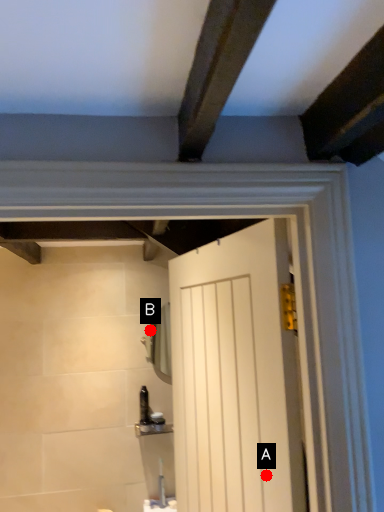
Question: Two points are circled on the image, labeled by A and B beside each circle. Which point is closer to the camera taking this photo?

Choices:
 (A) A is closer
 (B) B is closer

Answer: (A)